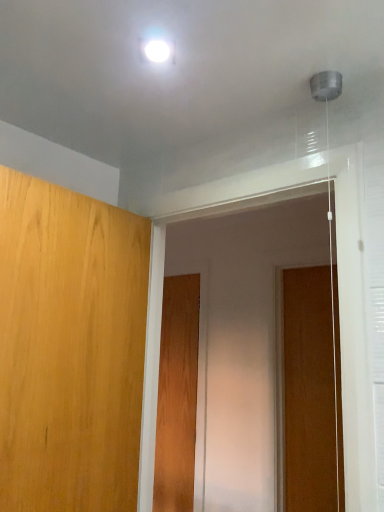
Question: Looking at their shapes, would you say light brown wood door at left, marked as the first door in a front-to-back arrangement, is wider or thinner than wooden door at right, the second door in the front-to-back sequence?

Choices:
 (A) thin
 (B) wide

Answer: (B)

Question: From a real-world perspective, is light brown wood door at left, marked as the first door in a front-to-back arrangement, physically located above or below wooden door at right, the second door in the front-to-back sequence?

Choices:
 (A) below
 (B) above

Answer: (B)

Question: Considering the real-world distances, which object is closest to the light brown wood door at left, the 3th door viewed from the back?

Choices:
 (A) wooden door at right, the 1th door from the right
 (B) transparent plastic screen door at center
 (C) wooden door at center, placed as the 2th door when sorted from right to left

Answer: (B)

Question: Estimate the real-world distances between objects in this image. Which object is closer to the transparent plastic screen door at center?

Choices:
 (A) light brown wood door at left, the first door positioned from the left
 (B) wooden door at right, acting as the 2th door starting from the back
 (C) wooden door at center, placed as the 2th door when sorted from right to left

Answer: (C)